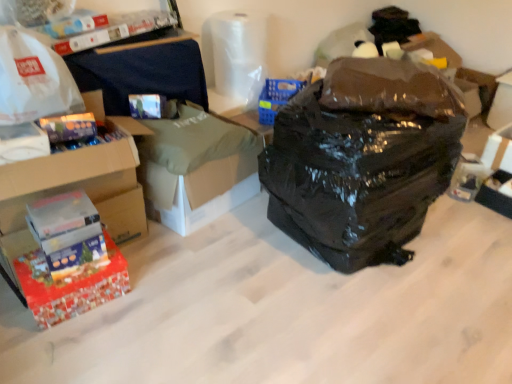
You are a GUI agent. You are given a task and a screenshot of the screen. Output one action in this format:
    pyautogui.click(x=<x>, y=<y>)
    Task: Click on the free spot to the right of black plastic bag at center
    The image size is (512, 384).
    Given the screenshot: What is the action you would take?
    pyautogui.click(x=465, y=246)